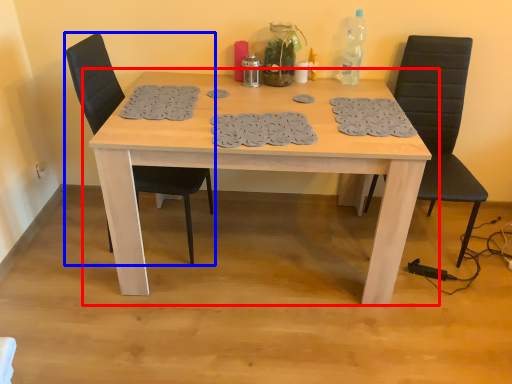
Question: Which point is further to the camera, table (highlighted by a red box) or chair (highlighted by a blue box)?

Choices:
 (A) table
 (B) chair

Answer: (B)